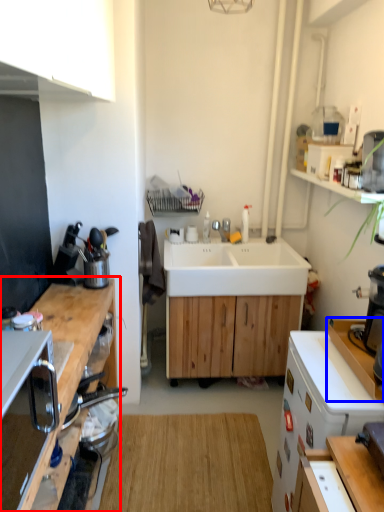
Question: Among these objects, which one is nearest to the camera, cabinetry (highlighted by a red box) or counter top (highlighted by a blue box)?

Choices:
 (A) cabinetry
 (B) counter top

Answer: (A)